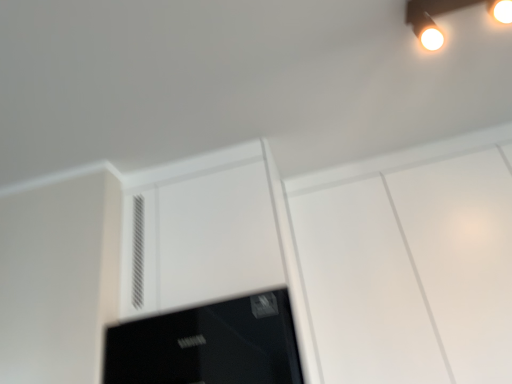
Where is `matte white spotlight at upper right`? The width and height of the screenshot is (512, 384). matte white spotlight at upper right is located at coordinates (446, 12).

What do you see at coordinates (446, 12) in the screenshot? I see `matte white spotlight at upper right` at bounding box center [446, 12].

Find the location of `matte white spotlight at upper right`. matte white spotlight at upper right is located at coordinates (446, 12).